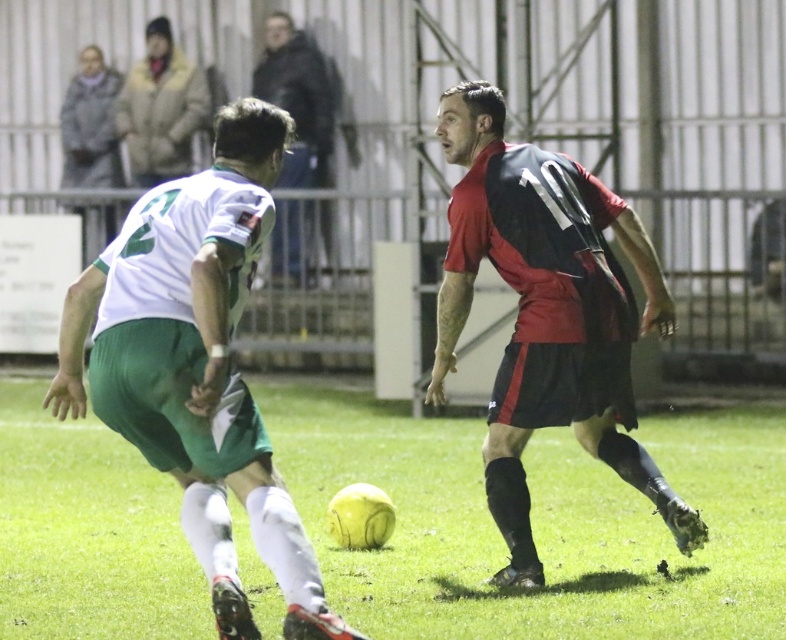
Question: Which point is closer to the camera taking this photo?

Choices:
 (A) (289, 216)
 (B) (417, 522)

Answer: (B)

Question: Is yellow matte soccer ball at center thinner than green matte shorts at center?

Choices:
 (A) no
 (B) yes

Answer: (B)

Question: Which point is closer to the camera taking this photo?

Choices:
 (A) (329, 129)
 (B) (270, 125)

Answer: (B)

Question: Does red matte jersey at center have a smaller size compared to black fabric jacket at upper center?

Choices:
 (A) yes
 (B) no

Answer: (B)

Question: Is yellow matte soccer ball at center above red matte jersey at center?

Choices:
 (A) no
 (B) yes

Answer: (A)

Question: Which object is closer to the camera taking this photo?

Choices:
 (A) red matte jersey at center
 (B) yellow matte soccer ball at center
 (C) green matte shorts at center
 (D) black fabric jacket at upper center

Answer: (C)